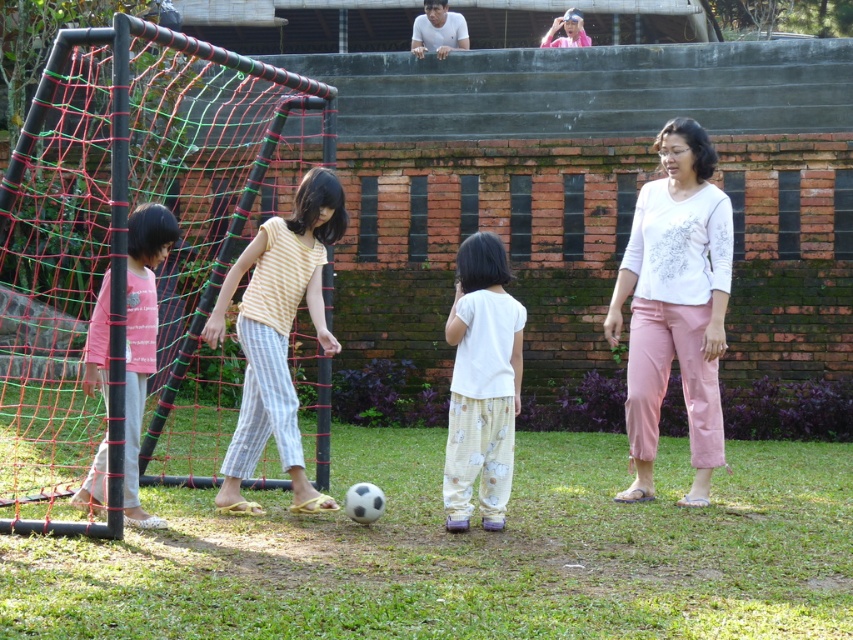
Question: Is white matte shirt at center wider than yellow striped shirt at center?

Choices:
 (A) yes
 (B) no

Answer: (B)

Question: Which of the following is the farthest from the observer?

Choices:
 (A) pink fabric shirt at left
 (B) white matte shirt at upper center
 (C) yellow striped shirt at center
 (D) pink fabric cap at upper center

Answer: (D)

Question: Does white matte shirt at center appear on the left side of pink fabric shirt at left?

Choices:
 (A) no
 (B) yes

Answer: (A)

Question: Where is pink fabric shirt at left located in relation to white matte shirt at upper center in the image?

Choices:
 (A) above
 (B) below

Answer: (B)

Question: Which object is positioned closest to the yellow striped shirt at center?

Choices:
 (A) white matte shirt at center
 (B) pink fabric cap at upper center

Answer: (A)

Question: Which point appears closest to the camera in this image?

Choices:
 (A) (581, 45)
 (B) (306, 218)

Answer: (B)